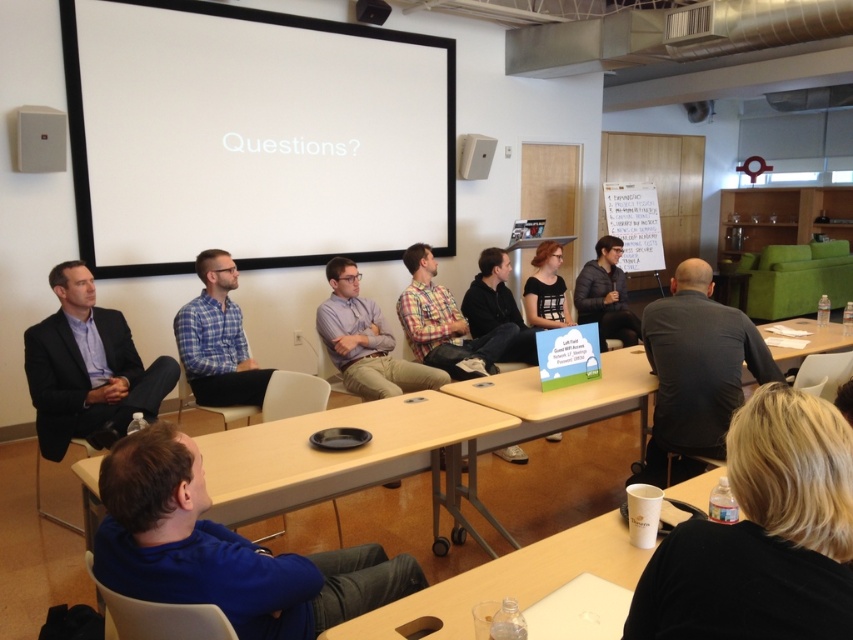
Question: Among these points, which one is farthest from the camera?

Choices:
 (A) (393, 358)
 (B) (541, 266)
 (C) (366, 12)

Answer: (C)

Question: Is dark gray hoodie at center further to camera compared to white plastic projector at upper center?

Choices:
 (A) no
 (B) yes

Answer: (A)

Question: Based on their relative distances, which object is farther from the matte black suit at left?

Choices:
 (A) plaid shirt at center
 (B) white plastic table at lower center
 (C) white matte projection screen at upper center
 (D) black textured shirt at center

Answer: (D)

Question: Which point appears farthest from the camera in this image?

Choices:
 (A) (828, 88)
 (B) (624, 298)
 (C) (537, 252)

Answer: (A)

Question: Can you confirm if white plastic table at lower center is positioned above purple shirt at center?

Choices:
 (A) no
 (B) yes

Answer: (A)

Question: Can you confirm if blue plaid shirt at center is positioned to the left of purple shirt at center?

Choices:
 (A) no
 (B) yes

Answer: (B)